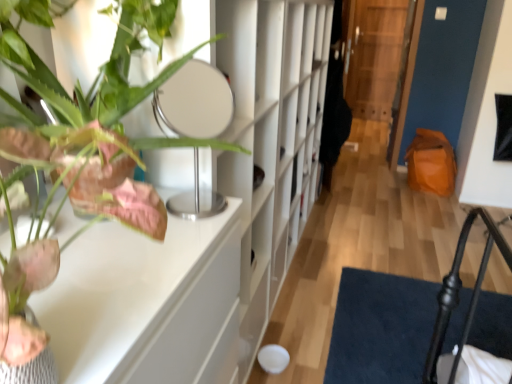
Question: Is transparent wooden door at center facing towards green matte plant at upper left?

Choices:
 (A) yes
 (B) no

Answer: (A)

Question: Is transparent wooden door at center smaller than green matte plant at upper left?

Choices:
 (A) no
 (B) yes

Answer: (A)

Question: Are transparent wooden door at center and green matte plant at upper left making contact?

Choices:
 (A) yes
 (B) no

Answer: (B)

Question: From the image's perspective, is transparent wooden door at center beneath green matte plant at upper left?

Choices:
 (A) yes
 (B) no

Answer: (B)

Question: Is transparent wooden door at center at the right side of green matte plant at upper left?

Choices:
 (A) yes
 (B) no

Answer: (A)

Question: From a real-world perspective, is transparent wooden door at center on green matte plant at upper left?

Choices:
 (A) yes
 (B) no

Answer: (B)

Question: Does white matte bookshelf at center have a larger size compared to white glossy table at upper left?

Choices:
 (A) no
 (B) yes

Answer: (B)

Question: From a real-world perspective, is white matte bookshelf at center on top of white glossy table at upper left?

Choices:
 (A) no
 (B) yes

Answer: (B)

Question: Is white matte bookshelf at center thinner than white glossy table at upper left?

Choices:
 (A) no
 (B) yes

Answer: (B)

Question: Does white matte bookshelf at center lie behind white glossy table at upper left?

Choices:
 (A) no
 (B) yes

Answer: (B)

Question: Would you say white matte bookshelf at center is a long distance from white glossy table at upper left?

Choices:
 (A) yes
 (B) no

Answer: (B)

Question: Considering the relative positions of white matte bookshelf at center and white glossy table at upper left in the image provided, is white matte bookshelf at center in front of white glossy table at upper left?

Choices:
 (A) yes
 (B) no

Answer: (B)

Question: Does white glossy table at upper left touch green matte plant at upper left?

Choices:
 (A) no
 (B) yes

Answer: (B)